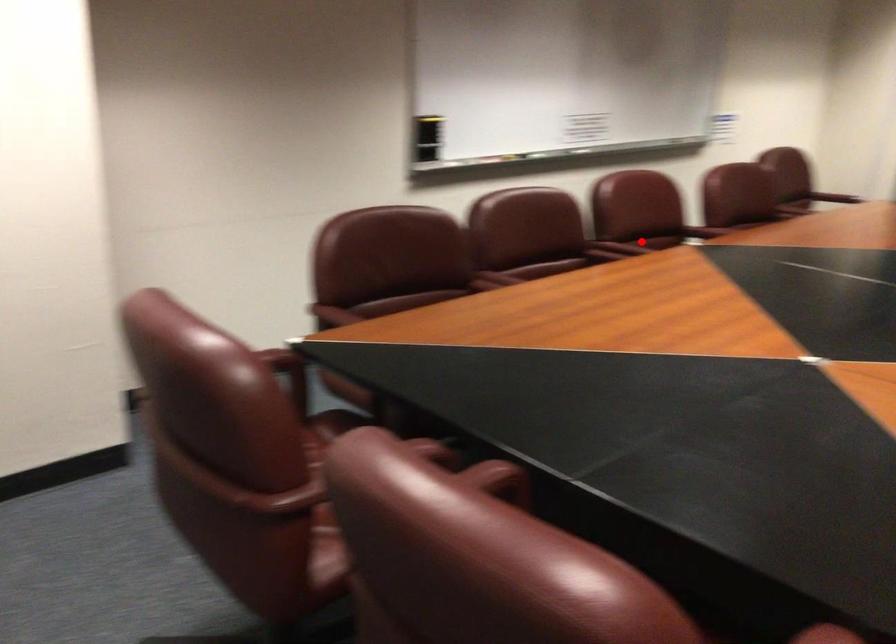
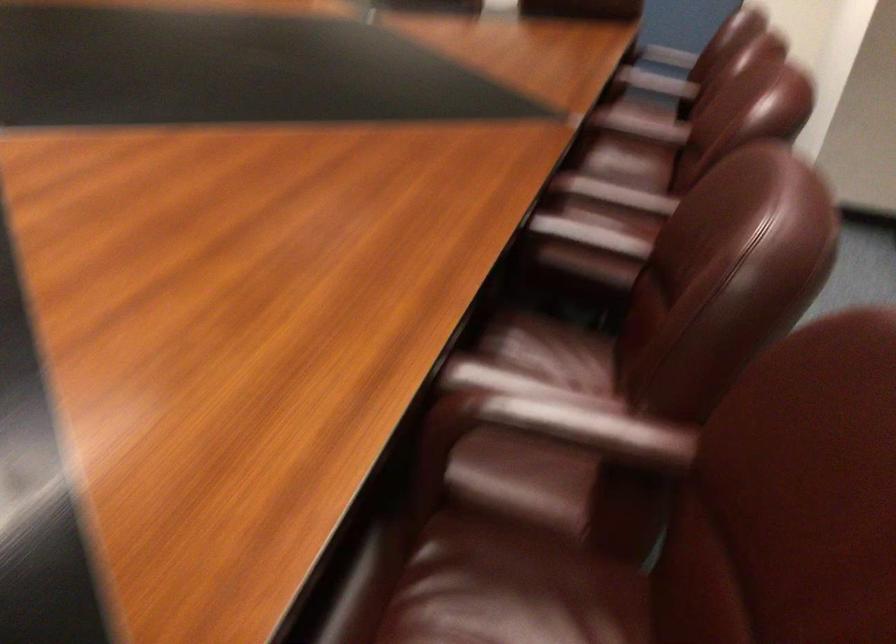
Where in the second image is the point corresponding to the highlighted location from the first image?

(640, 126)